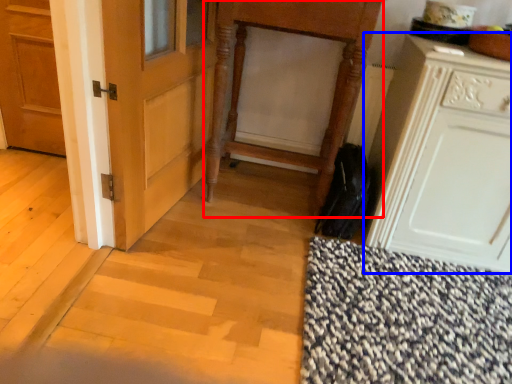
Question: Which object is further to the camera taking this photo, vanity (highlighted by a red box) or cabinetry (highlighted by a blue box)?

Choices:
 (A) vanity
 (B) cabinetry

Answer: (A)